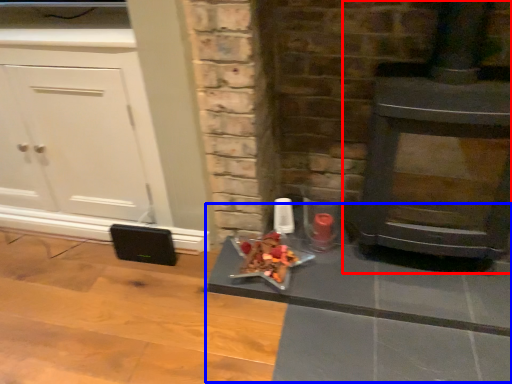
Question: Among these objects, which one is nearest to the camera, wood burning stove (highlighted by a red box) or table (highlighted by a blue box)?

Choices:
 (A) wood burning stove
 (B) table

Answer: (A)